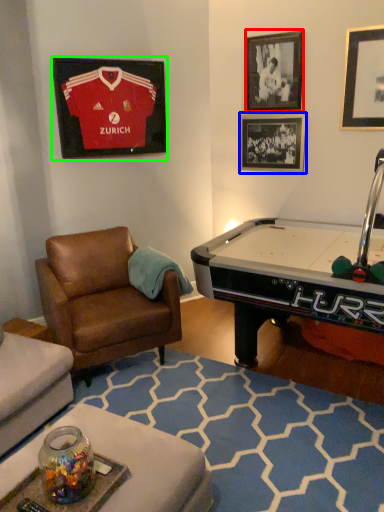
Question: Which is nearer to the picture frame (highlighted by a red box)? picture frame (highlighted by a blue box) or picture frame (highlighted by a green box).

Choices:
 (A) picture frame
 (B) picture frame

Answer: (A)